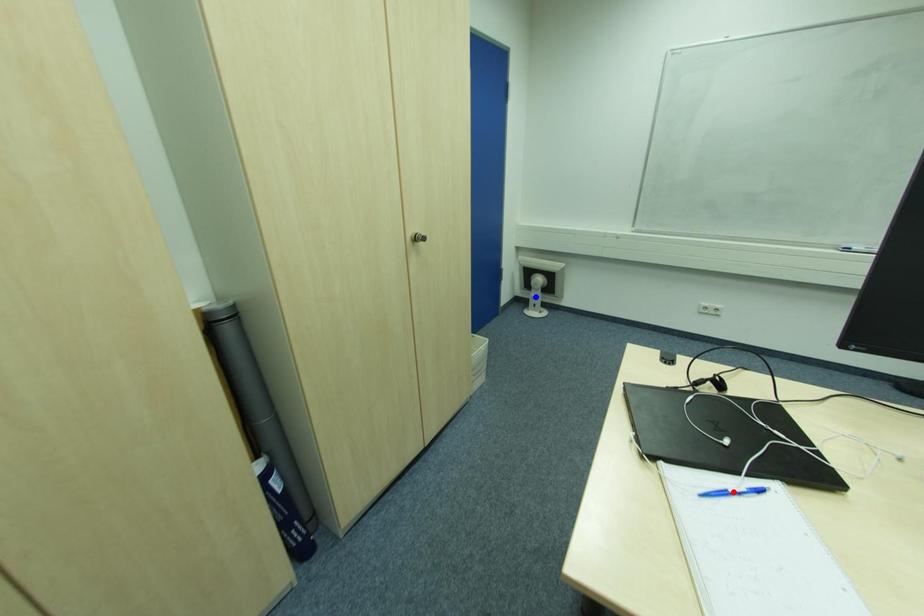
Question: Two points are marked on the image. Which point is closer to the camera?

Choices:
 (A) Blue point is closer.
 (B) Red point is closer.

Answer: (B)